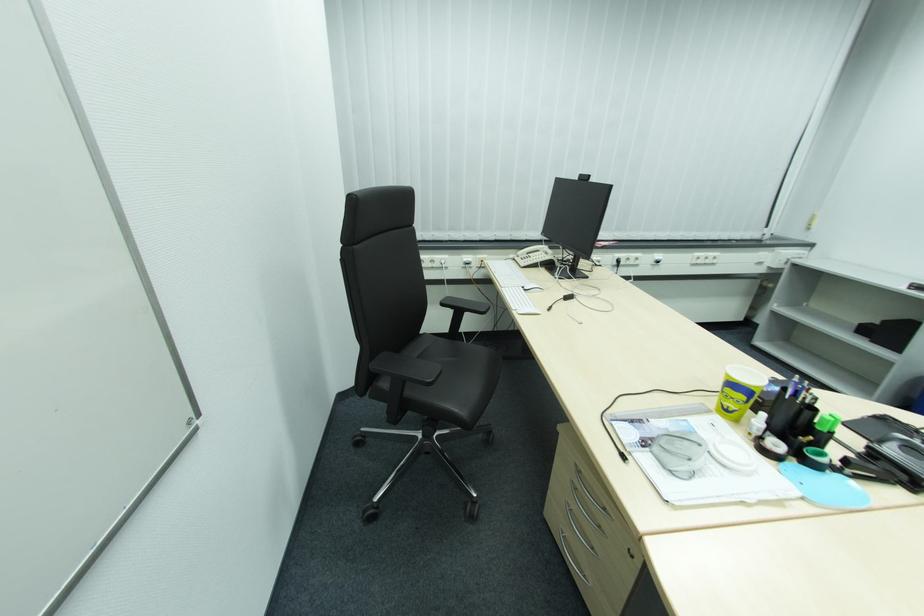
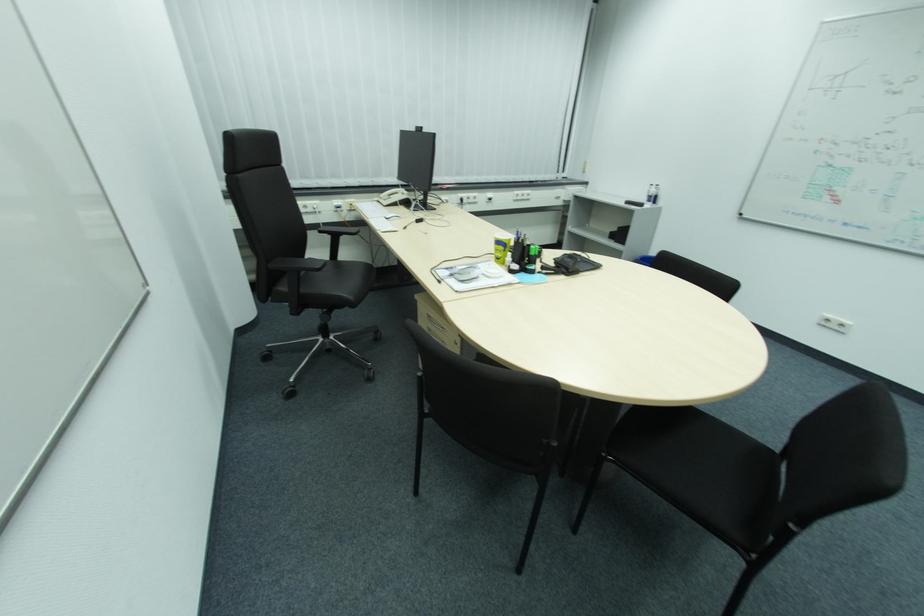
Find the pixel in the second image that matches (543,251) in the first image.

(403, 193)